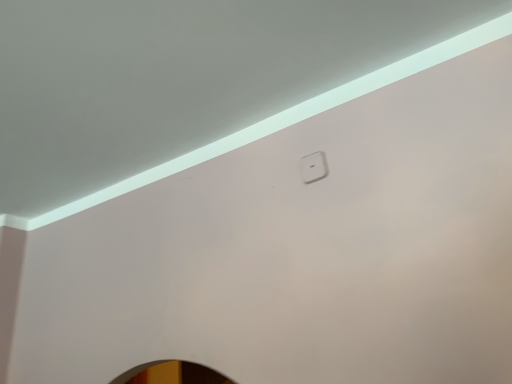
Question: Should I look upward or downward to see white plastic light switch at upper center?

Choices:
 (A) up
 (B) down

Answer: (A)